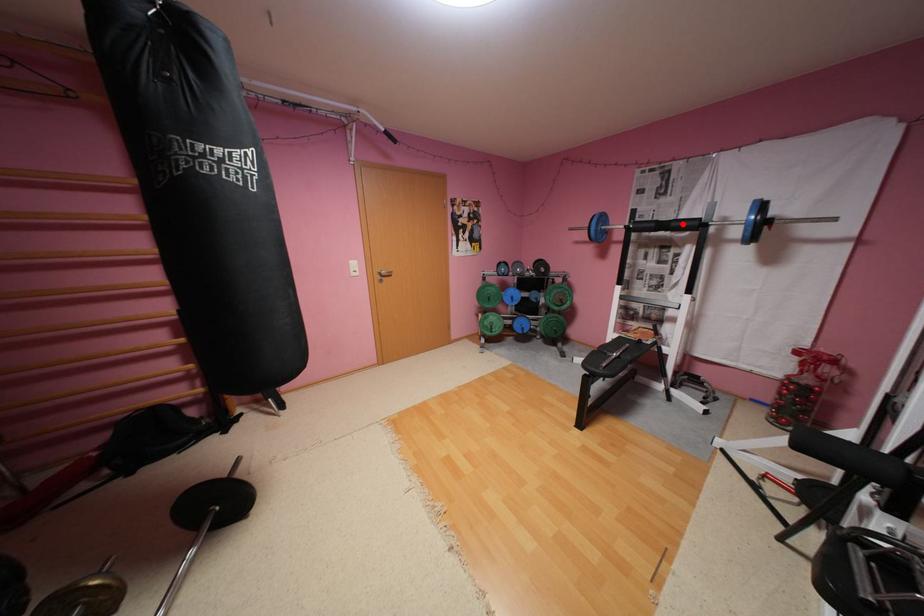
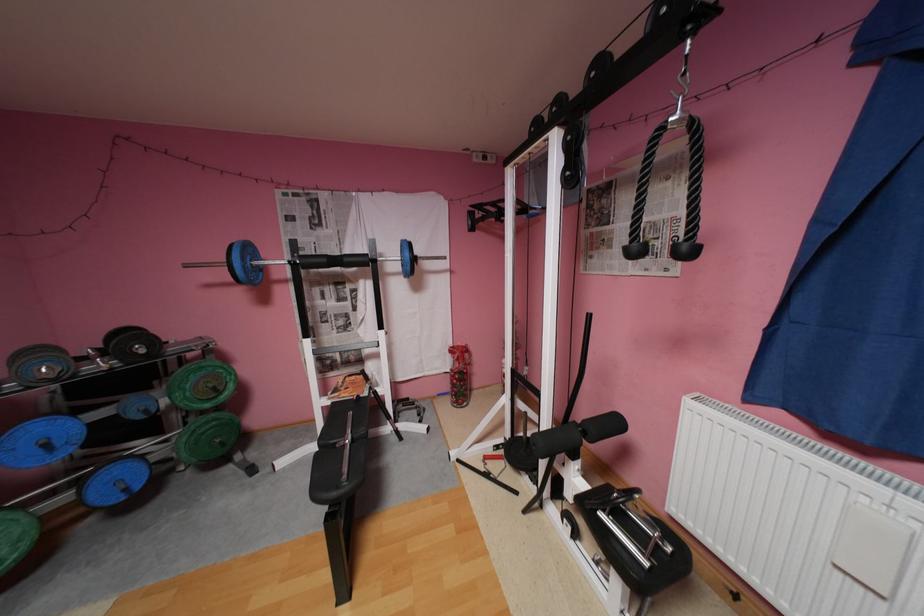
Question: I am providing you with two images of the same scene from different viewpoints. A red point is marked on the first image. Is the red point's position out of view in image 2?

Choices:
 (A) Yes
 (B) No

Answer: (B)